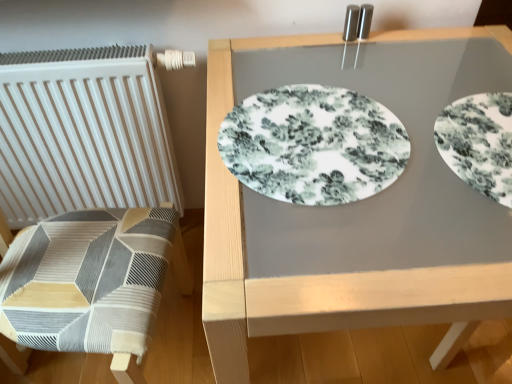
Question: Is white matte radiator at left closer to camera compared to white floral plate at upper right, placed as the first plate when sorted from right to left?

Choices:
 (A) yes
 (B) no

Answer: (B)

Question: Considering the relative sizes of white matte radiator at left and white floral plate at upper right, marked as the second plate in a left-to-right arrangement, in the image provided, is white matte radiator at left thinner than white floral plate at upper right, marked as the second plate in a left-to-right arrangement,?

Choices:
 (A) yes
 (B) no

Answer: (A)

Question: Can you confirm if white matte radiator at left is smaller than white floral plate at upper right, marked as the second plate in a left-to-right arrangement?

Choices:
 (A) no
 (B) yes

Answer: (A)

Question: From the image's perspective, does white matte radiator at left appear lower than white floral plate at upper right, placed as the first plate when sorted from right to left?

Choices:
 (A) yes
 (B) no

Answer: (B)

Question: Is white matte radiator at left positioned with its back to white floral plate at upper right, placed as the first plate when sorted from right to left?

Choices:
 (A) no
 (B) yes

Answer: (A)

Question: From the image's perspective, relative to white floral plate at center, the 2th plate in the right-to-left sequence, is white floral plate at upper right, marked as the second plate in a left-to-right arrangement, above or below?

Choices:
 (A) below
 (B) above

Answer: (A)

Question: In terms of height, does white floral plate at upper right, placed as the first plate when sorted from right to left, look taller or shorter compared to white floral plate at center, the 2th plate in the right-to-left sequence?

Choices:
 (A) short
 (B) tall

Answer: (A)

Question: From a real-world perspective, is white floral plate at upper right, placed as the first plate when sorted from right to left, above or below white floral plate at center, the 1th plate in the left-to-right sequence?

Choices:
 (A) above
 (B) below

Answer: (A)

Question: Visually, is white floral plate at upper right, placed as the first plate when sorted from right to left, positioned to the left or to the right of white floral plate at center, the 2th plate in the right-to-left sequence?

Choices:
 (A) right
 (B) left

Answer: (A)

Question: Considering the positions of white glossy placemat at center and white floral plate at center, the 2th plate in the right-to-left sequence, in the image, is white glossy placemat at center wider or thinner than white floral plate at center, the 2th plate in the right-to-left sequence,?

Choices:
 (A) wide
 (B) thin

Answer: (A)

Question: Based on their positions, is white glossy placemat at center located to the left or right of white floral plate at center, the 1th plate in the left-to-right sequence?

Choices:
 (A) right
 (B) left

Answer: (A)

Question: Is white glossy placemat at center taller or shorter than white floral plate at center, the 2th plate in the right-to-left sequence?

Choices:
 (A) tall
 (B) short

Answer: (A)

Question: From the image's perspective, is white glossy placemat at center positioned above or below white floral plate at center, the 1th plate in the left-to-right sequence?

Choices:
 (A) above
 (B) below

Answer: (B)

Question: Is white floral plate at upper right, marked as the second plate in a left-to-right arrangement, wider or thinner than white glossy placemat at center?

Choices:
 (A) wide
 (B) thin

Answer: (B)

Question: Considering the positions of point (474, 178) and point (388, 311), is point (474, 178) closer or farther from the camera than point (388, 311)?

Choices:
 (A) closer
 (B) farther

Answer: (B)